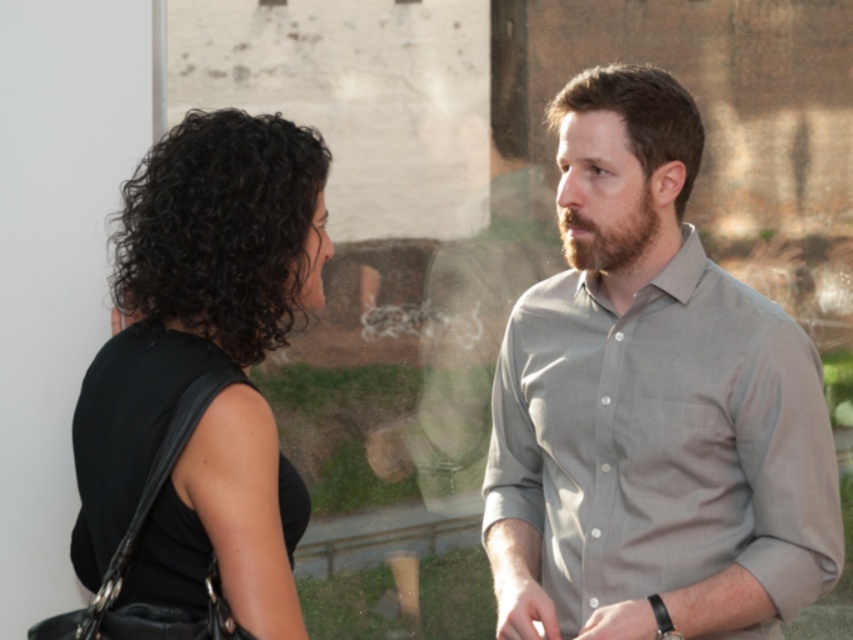
Question: Among these objects, which one is nearest to the camera?

Choices:
 (A) brownwoollybeard at right
 (B) black matte dress at left
 (C) gray cotton shirt at right

Answer: (B)

Question: Is black matte dress at left to the right of brownwoollybeard at right from the viewer's perspective?

Choices:
 (A) no
 (B) yes

Answer: (A)

Question: Where is black matte dress at left located in relation to brownwoollybeard at right in the image?

Choices:
 (A) left
 (B) right

Answer: (A)

Question: Among these objects, which one is farthest from the camera?

Choices:
 (A) gray cotton shirt at right
 (B) brownwoollybeard at right

Answer: (B)

Question: Which point is closer to the camera?

Choices:
 (A) (161, 508)
 (B) (651, 230)
 (C) (595, 582)

Answer: (A)

Question: Is gray cotton shirt at right closer to the viewer compared to black matte dress at left?

Choices:
 (A) yes
 (B) no

Answer: (B)